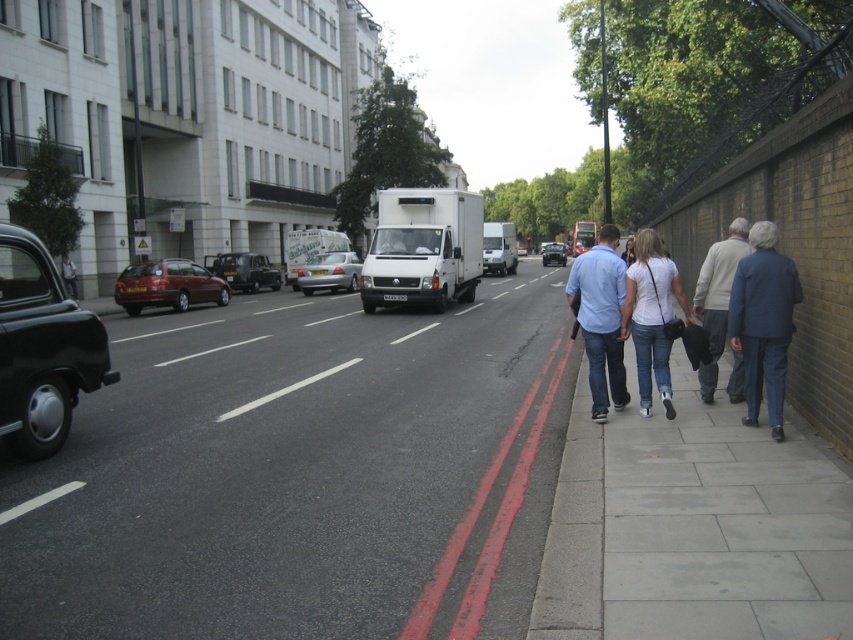
Question: Which of the following is the farthest from the observer?

Choices:
 (A) [x=720, y=291]
 (B) [x=643, y=394]

Answer: (A)

Question: Which point appears farthest from the camera in this image?

Choices:
 (A) (564, 262)
 (B) (648, 337)
 (C) (664, 333)
 (D) (245, 275)

Answer: (A)

Question: Observing the image, what is the correct spatial positioning of denim jeans at sidewalk center in reference to metallic silver suv at center-left?

Choices:
 (A) right
 (B) left

Answer: (A)

Question: Does light blue shirt at center have a smaller size compared to silver metallic car at center?

Choices:
 (A) no
 (B) yes

Answer: (B)

Question: Which object is positioned farthest from the matte black van at center?

Choices:
 (A) light blue shirt at center
 (B) denim jeans at sidewalk center
 (C) matte black car at left
 (D) matte red station wagon at center-left

Answer: (C)

Question: Does silver metallic car at center have a larger size compared to matte black van at center?

Choices:
 (A) yes
 (B) no

Answer: (B)